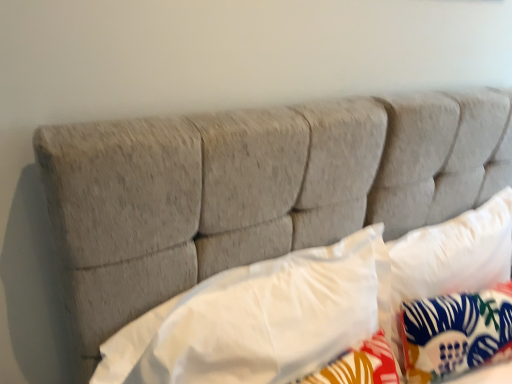
Image resolution: width=512 pixels, height=384 pixels. What do you see at coordinates (456, 333) in the screenshot?
I see `blue floral fabric pillow at center, which ranks as the 3th pillow in left-to-right order` at bounding box center [456, 333].

Where is `white soft pillow at center, which is counted as the 1th pillow, starting from the left`? Image resolution: width=512 pixels, height=384 pixels. white soft pillow at center, which is counted as the 1th pillow, starting from the left is located at coordinates (258, 319).

The image size is (512, 384). I want to click on blue floral fabric pillow at center, which is counted as the 1th pillow, starting from the right, so click(456, 333).

Is blue floral fabric pillow at center, which is counted as the 1th pillow, starting from the right, facing away from white soft pillow at center, which is the 3th pillow in right-to-left order?

No.

Which of these two, blue floral fabric pillow at center, which ranks as the 3th pillow in left-to-right order, or white soft pillow at center, which is the 3th pillow in right-to-left order, is thinner?

blue floral fabric pillow at center, which ranks as the 3th pillow in left-to-right order, is thinner.

Is blue floral fabric pillow at center, which is counted as the 1th pillow, starting from the right, to the right of white soft pillow at center, which is counted as the 1th pillow, starting from the left, from the viewer's perspective?

Correct, you'll find blue floral fabric pillow at center, which is counted as the 1th pillow, starting from the right, to the right of white soft pillow at center, which is counted as the 1th pillow, starting from the left.

Is there a large distance between blue floral fabric pillow at center, which is counted as the 1th pillow, starting from the right, and white soft pillow at center, which is counted as the 1th pillow, starting from the left?

blue floral fabric pillow at center, which is counted as the 1th pillow, starting from the right, is actually quite close to white soft pillow at center, which is counted as the 1th pillow, starting from the left.

Based on the photo, is white fabric pillow at center, which is the second pillow from left to right, inside or outside of white soft pillow at center, which is the 3th pillow in right-to-left order?

white fabric pillow at center, which is the second pillow from left to right, is outside white soft pillow at center, which is the 3th pillow in right-to-left order.

Considering the points (495, 270) and (348, 248), which point is behind, point (495, 270) or point (348, 248)?

The point (495, 270) is more distant.

Considering the sizes of white fabric pillow at center, which is the second pillow from left to right, and white soft pillow at center, which is counted as the 1th pillow, starting from the left, in the image, is white fabric pillow at center, which is the second pillow from left to right, taller or shorter than white soft pillow at center, which is counted as the 1th pillow, starting from the left,?

Clearly, white fabric pillow at center, which is the second pillow from left to right, is taller compared to white soft pillow at center, which is counted as the 1th pillow, starting from the left.

From a real-world perspective, does white fabric pillow at center, which is the second pillow from left to right, stand above white soft pillow at center, which is the 3th pillow in right-to-left order?

No.

Considering the positions of point (180, 327) and point (481, 216), is point (180, 327) closer or farther from the camera than point (481, 216)?

Point (180, 327) appears to be closer to the viewer than point (481, 216).

Can we say white soft pillow at center, which is counted as the 1th pillow, starting from the left, lies outside white fabric pillow at center, arranged as the second pillow when viewed from the right?

white soft pillow at center, which is counted as the 1th pillow, starting from the left, lies outside white fabric pillow at center, arranged as the second pillow when viewed from the right,'s area.

Is the position of white soft pillow at center, which is the 3th pillow in right-to-left order, less distant than that of white fabric pillow at center, which is the second pillow from left to right?

Yes, white soft pillow at center, which is the 3th pillow in right-to-left order, is closer to the camera.

From the image's perspective, is white soft pillow at center, which is the 3th pillow in right-to-left order, located above or below white fabric pillow at center, which is the second pillow from left to right?

From the image's perspective, white soft pillow at center, which is the 3th pillow in right-to-left order, appears below white fabric pillow at center, which is the second pillow from left to right.

From the image's perspective, which is below, white soft pillow at center, which is the 3th pillow in right-to-left order, or blue floral fabric pillow at center, which ranks as the 3th pillow in left-to-right order?

blue floral fabric pillow at center, which ranks as the 3th pillow in left-to-right order, from the image's perspective.

Is there a large distance between white soft pillow at center, which is the 3th pillow in right-to-left order, and blue floral fabric pillow at center, which is counted as the 1th pillow, starting from the right?

white soft pillow at center, which is the 3th pillow in right-to-left order, is actually quite close to blue floral fabric pillow at center, which is counted as the 1th pillow, starting from the right.

Which is more to the right, white soft pillow at center, which is the 3th pillow in right-to-left order, or blue floral fabric pillow at center, which is counted as the 1th pillow, starting from the right?

blue floral fabric pillow at center, which is counted as the 1th pillow, starting from the right, is more to the right.

Is white soft pillow at center, which is counted as the 1th pillow, starting from the left, located outside blue floral fabric pillow at center, which ranks as the 3th pillow in left-to-right order?

Indeed, white soft pillow at center, which is counted as the 1th pillow, starting from the left, is completely outside blue floral fabric pillow at center, which ranks as the 3th pillow in left-to-right order.

Considering the sizes of objects white fabric pillow at center, arranged as the second pillow when viewed from the right, and blue floral fabric pillow at center, which is counted as the 1th pillow, starting from the right, in the image provided, who is shorter, white fabric pillow at center, arranged as the second pillow when viewed from the right, or blue floral fabric pillow at center, which is counted as the 1th pillow, starting from the right,?

blue floral fabric pillow at center, which is counted as the 1th pillow, starting from the right, is shorter.

Is white fabric pillow at center, which is the second pillow from left to right, wider or thinner than blue floral fabric pillow at center, which ranks as the 3th pillow in left-to-right order?

Clearly, white fabric pillow at center, which is the second pillow from left to right, has more width compared to blue floral fabric pillow at center, which ranks as the 3th pillow in left-to-right order.

Is white fabric pillow at center, which is the second pillow from left to right, not inside blue floral fabric pillow at center, which is counted as the 1th pillow, starting from the right?

Yes.

From a real-world perspective, is blue floral fabric pillow at center, which ranks as the 3th pillow in left-to-right order, physically above white fabric pillow at center, which is the second pillow from left to right?

No, from a real-world perspective, blue floral fabric pillow at center, which ranks as the 3th pillow in left-to-right order, is not over white fabric pillow at center, which is the second pillow from left to right

From the image's perspective, is blue floral fabric pillow at center, which is counted as the 1th pillow, starting from the right, on top of white fabric pillow at center, arranged as the second pillow when viewed from the right?

No, from the image's perspective, blue floral fabric pillow at center, which is counted as the 1th pillow, starting from the right, is not on top of white fabric pillow at center, arranged as the second pillow when viewed from the right.

You are a GUI agent. You are given a task and a screenshot of the screen. Output one action in this format:
    pyautogui.click(x=<x>, y=<y>)
    Task: Click on the pillow below the white soft pillow at center, which is the 3th pillow in right-to-left order (from the image's perspective)
    
    Given the screenshot: What is the action you would take?
    pyautogui.click(x=456, y=333)

Find the location of `pillow located above the white soft pillow at center, which is counted as the 1th pillow, starting from the left (from the image's perspective)`. pillow located above the white soft pillow at center, which is counted as the 1th pillow, starting from the left (from the image's perspective) is located at coordinates (452, 257).

When comparing their distances from white soft pillow at center, which is the 3th pillow in right-to-left order, does blue floral fabric pillow at center, which ranks as the 3th pillow in left-to-right order, or white fabric pillow at center, which is the second pillow from left to right, seem further?

white fabric pillow at center, which is the second pillow from left to right, is further to white soft pillow at center, which is the 3th pillow in right-to-left order.

When comparing their distances from white soft pillow at center, which is the 3th pillow in right-to-left order, does white fabric pillow at center, arranged as the second pillow when viewed from the right, or blue floral fabric pillow at center, which is counted as the 1th pillow, starting from the right, seem closer?

blue floral fabric pillow at center, which is counted as the 1th pillow, starting from the right, is closer to white soft pillow at center, which is the 3th pillow in right-to-left order.

Considering their positions, is white fabric pillow at center, which is the second pillow from left to right, positioned further to blue floral fabric pillow at center, which ranks as the 3th pillow in left-to-right order, than white soft pillow at center, which is the 3th pillow in right-to-left order?

white soft pillow at center, which is the 3th pillow in right-to-left order, is positioned further to the anchor blue floral fabric pillow at center, which ranks as the 3th pillow in left-to-right order.

Estimate the real-world distances between objects in this image. Which object is further from white fabric pillow at center, arranged as the second pillow when viewed from the right, blue floral fabric pillow at center, which ranks as the 3th pillow in left-to-right order, or white soft pillow at center, which is the 3th pillow in right-to-left order?

Based on the image, white soft pillow at center, which is the 3th pillow in right-to-left order, appears to be further to white fabric pillow at center, arranged as the second pillow when viewed from the right.

In the scene shown: Based on their spatial positions, is white soft pillow at center, which is counted as the 1th pillow, starting from the left, or white fabric pillow at center, arranged as the second pillow when viewed from the right, closer to blue floral fabric pillow at center, which ranks as the 3th pillow in left-to-right order?

white fabric pillow at center, arranged as the second pillow when viewed from the right, lies closer to blue floral fabric pillow at center, which ranks as the 3th pillow in left-to-right order, than the other object.

Consider the image. From the image, which object appears to be nearer to white fabric pillow at center, arranged as the second pillow when viewed from the right, white soft pillow at center, which is counted as the 1th pillow, starting from the left, or blue floral fabric pillow at center, which ranks as the 3th pillow in left-to-right order?

blue floral fabric pillow at center, which ranks as the 3th pillow in left-to-right order.

I want to click on pillow between white soft pillow at center, which is the 3th pillow in right-to-left order, and blue floral fabric pillow at center, which is counted as the 1th pillow, starting from the right, from left to right, so click(x=452, y=257).